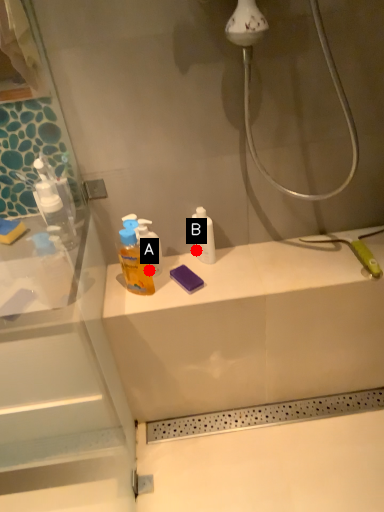
Question: Two points are circled on the image, labeled by A and B beside each circle. Which point is closer to the camera taking this photo?

Choices:
 (A) A is closer
 (B) B is closer

Answer: (A)